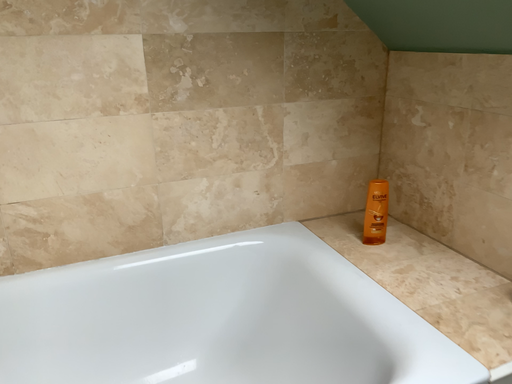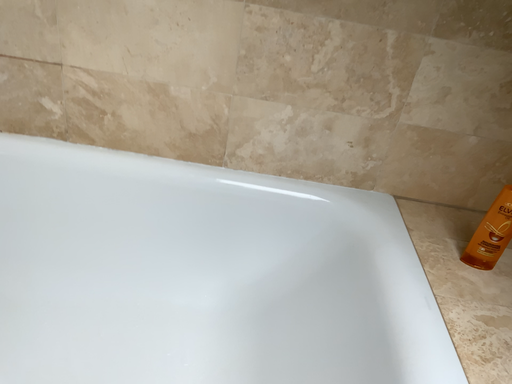
Question: Which way did the camera rotate in the video?

Choices:
 (A) rotated left
 (B) rotated right

Answer: (A)